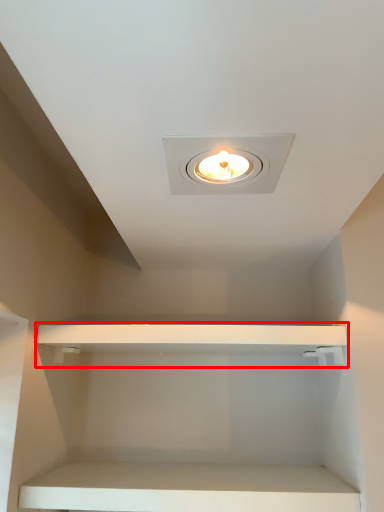
Question: In this image, where is cabinet (annotated by the red box) located relative to cabinet?

Choices:
 (A) left
 (B) right

Answer: (B)